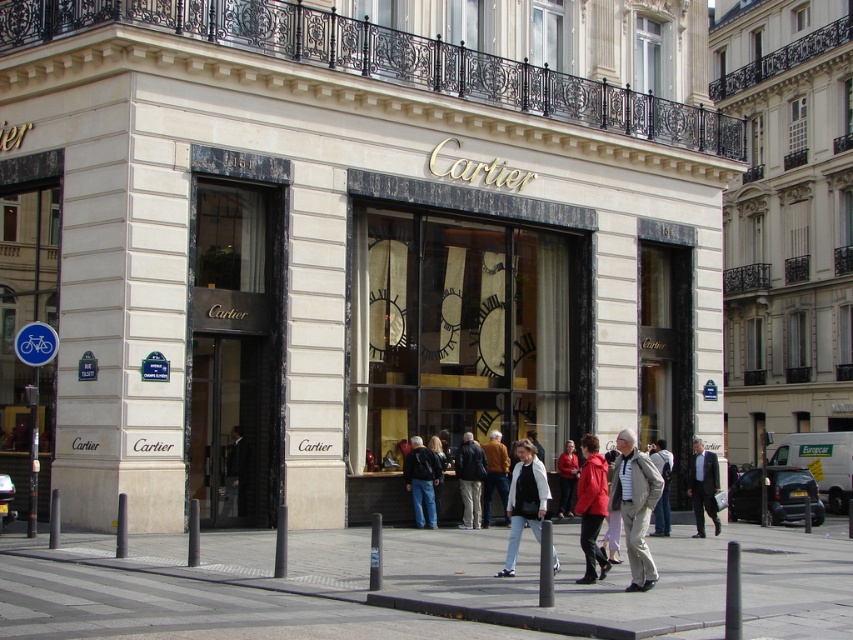
Question: Which of the following is the closest to the observer?

Choices:
 (A) gray concrete pavement at lower center
 (B) red leather jacket at center

Answer: (A)

Question: Does gold glass clock at center have a smaller size compared to white denim jeans at center?

Choices:
 (A) yes
 (B) no

Answer: (B)

Question: Is the position of matte gold clock at center less distant than that of white denim jeans at center?

Choices:
 (A) no
 (B) yes

Answer: (A)

Question: Among these points, which one is farthest from the camera?

Choices:
 (A) (480, 460)
 (B) (664, 499)
 (C) (494, 440)

Answer: (C)

Question: Among these points, which one is farthest from the camera?

Choices:
 (A) (155, 60)
 (B) (517, 483)
 (C) (410, 444)

Answer: (C)

Question: Observing the image, what is the correct spatial positioning of dark gray suit at center in reference to dark brown leather jacket at center?

Choices:
 (A) above
 (B) below

Answer: (A)